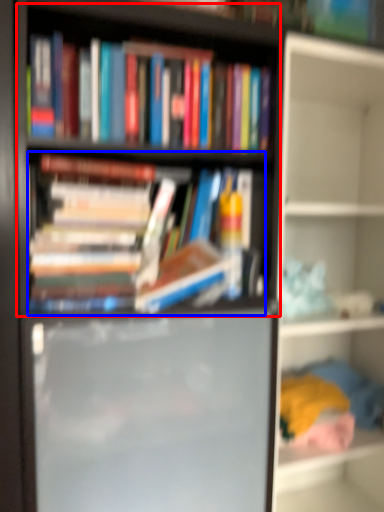
Question: Which point is closer to the camera, bookshelf (highlighted by a red box) or book (highlighted by a blue box)?

Choices:
 (A) bookshelf
 (B) book

Answer: (A)